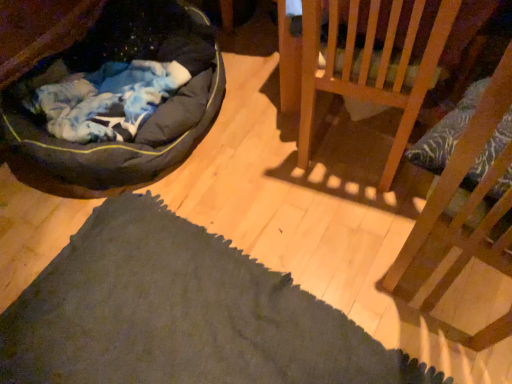
Where is `vacant space situated on the left part of wooden chair at upper right, arranged as the first furniture when viewed from the back`? Image resolution: width=512 pixels, height=384 pixels. vacant space situated on the left part of wooden chair at upper right, arranged as the first furniture when viewed from the back is located at coordinates (271, 154).